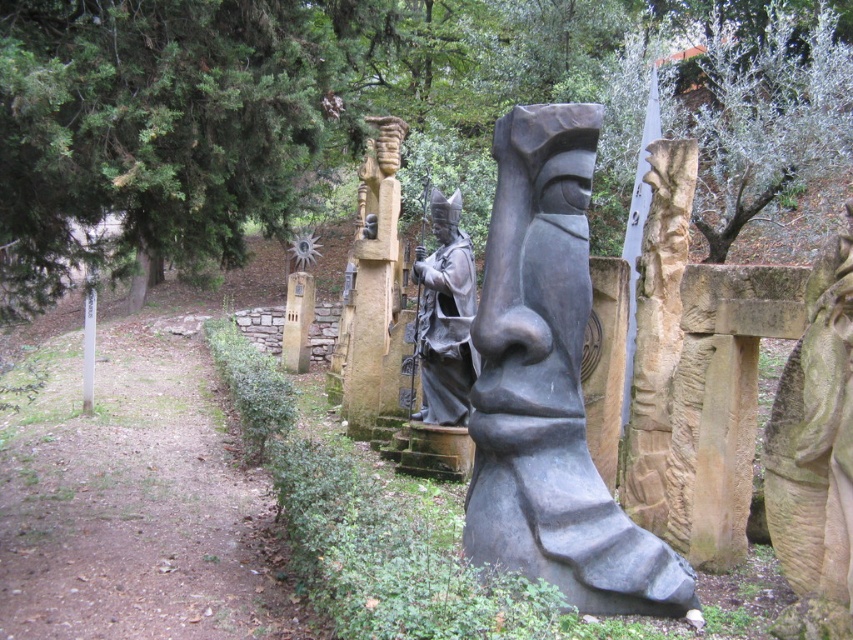
You are standing in the sculpture garden and want to take a photo of the point at coordinates point (41, 577). The camera you have can only focus on objects within 10 feet. Will the point be in focus?

The point (41, 577) is 15.23 feet away from the camera, which is beyond the 10 feet focus range. Therefore, the point will not be in focus.

You are a gardener who wants to place a new flower pot that is 1 meter tall on the dirt path at center. Considering the stone statue at right, will the flower pot be visible from the front entrance of the garden? Please explain your reasoning.

The dirt path at center is not as tall as the stone statue at right. Since the flower pot is 1 meter tall and the path is lower than the statue, the flower pot might be partially obscured by the statue when viewed from the front entrance. However, its visibility would depend on the exact placement and the statue height. Without knowing the statue height, we can only assume the path is lower, so the flower pot could be less visible.